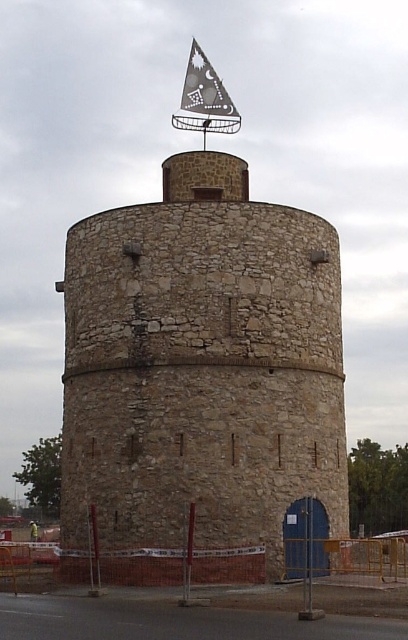
You are a visitor standing at the base of the stone tower at center. You notice a gray fabric flag at top flying above it. Can you determine if the flag is taller than the tower?

The stone tower at center is taller than the gray fabric flag at top, so the flag is not taller than the tower.

You are standing in front of the stone tower. A tour guide asks you to locate a specific point on the tower. The point is at coordinates (x=201, y=368). Where on the tower would this point be located?

The point at coordinates (x=201, y=368) is on the stone tower at center, so it would be located on the main body of the tower.